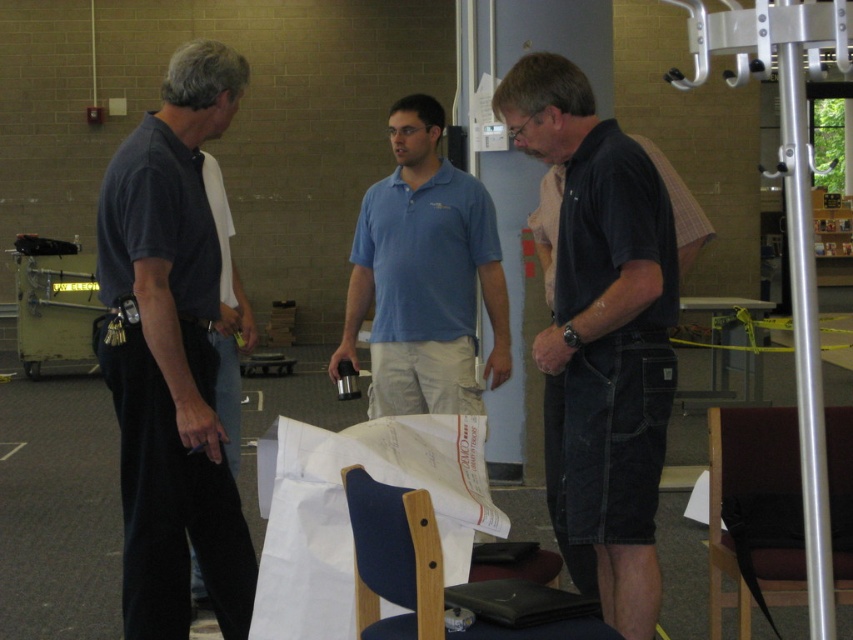
You are a tailor measuring clothes for two customers. One is wearing a black cotton shirt at center and the other is wearing dark blue jeans at left. Which garment has a larger width measurement?

The black cotton shirt at center has a larger width than the dark blue jeans at left according to the description.

You are a delivery person who needs to place a 1.2 meter wide package between the blue fabric chair at lower center and the dark blue jeans at left. Can you fit it there?

The blue fabric chair at lower center might be wider than dark blue jeans at left, but since the exact width isn

Based on the coordinates provided, which object is located at point (602, 332)?

The point (602, 332) corresponds to the black cotton shirt at center.